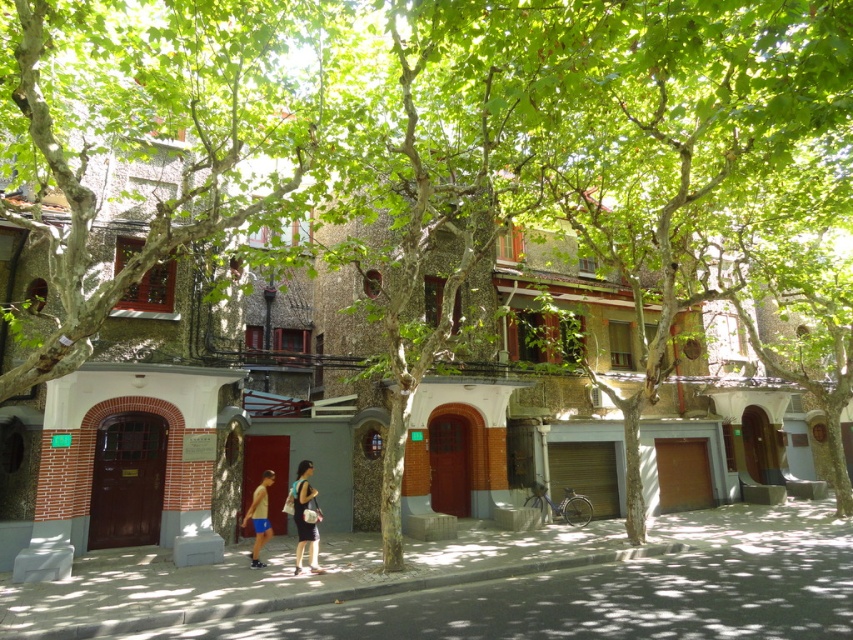
Question: Which of the following is the closest to the observer?

Choices:
 (A) matte black shorts at center
 (B) tan skin man at center
 (C) matte black dress at center

Answer: (C)

Question: Does matte black shorts at center appear over matte black dress at center?

Choices:
 (A) no
 (B) yes

Answer: (A)

Question: Is matte black dress at center below tan skin man at center?

Choices:
 (A) yes
 (B) no

Answer: (B)

Question: Estimate the real-world distances between objects in this image. Which object is farther from the tan skin man at center?

Choices:
 (A) matte black shorts at center
 (B) matte black dress at center

Answer: (B)

Question: Which point is closer to the camera?

Choices:
 (A) matte black shorts at center
 (B) matte black dress at center
 (C) tan skin man at center

Answer: (B)

Question: Does matte black dress at center lie in front of tan skin man at center?

Choices:
 (A) yes
 (B) no

Answer: (A)